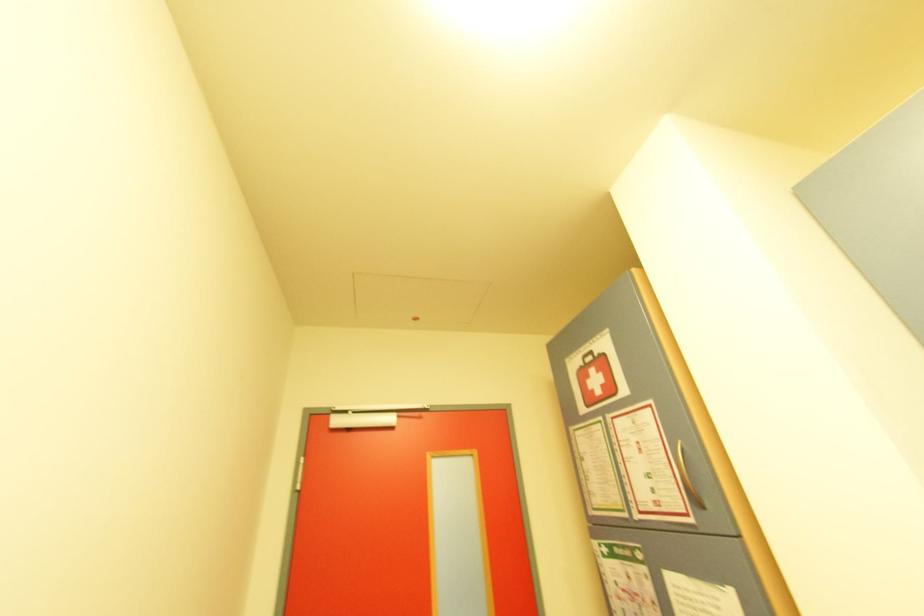
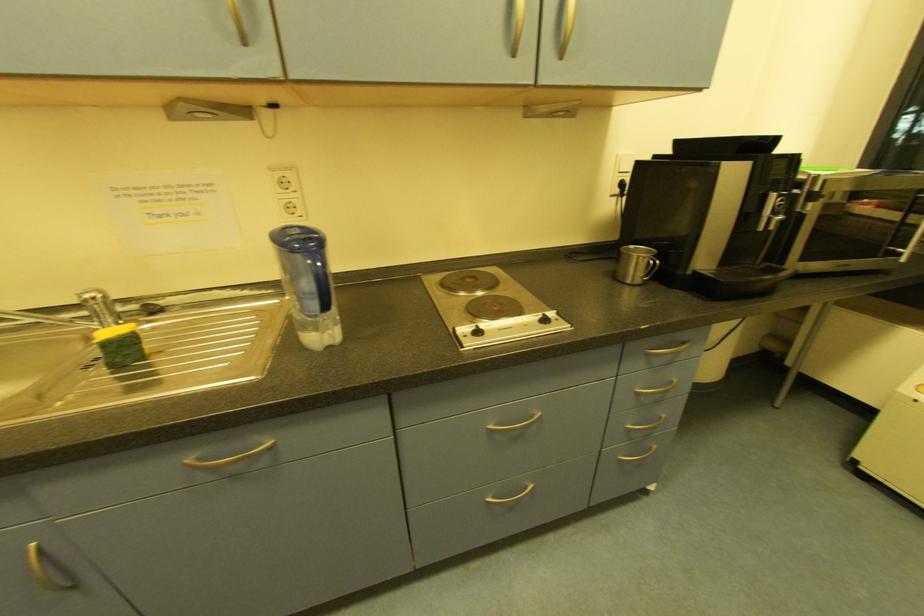
Based on the photo, the images are taken continuously from a first-person perspective. In which direction is your viewpoint rotating?

The camera rotated toward right-down.